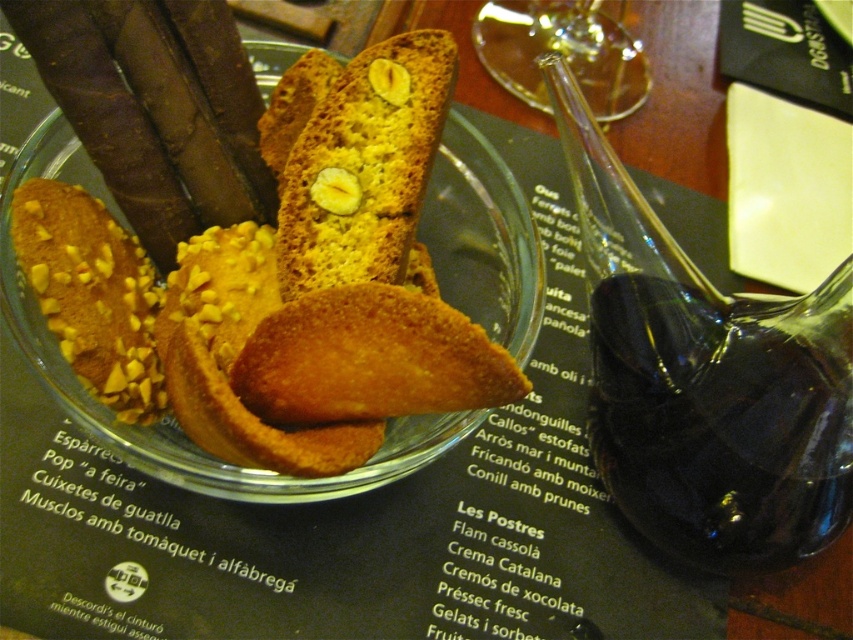
In the scene shown: You are a customer at a dessert bar and see both the golden crumbly biscuit at center and the golden crumbly biscotti at center. Which one is placed directly below the other?

The golden crumbly biscuit at center is positioned under the golden crumbly biscotti at center, so the biscuit is directly below the biscotti.

You are a customer at the dessert counter and want to know which item is taller between the golden crumbly biscotti at center and the transparent glass at upper center. Can you tell me based on their positions?

The golden crumbly biscotti at center is much taller than the transparent glass at upper center according to their positions.

You are a customer at a cafe and want to choose between the golden crumbly biscotti at center and the transparent glass at upper center. Based on their sizes, which one is smaller?

The golden crumbly biscotti at center has a lesser width compared to the transparent glass at upper center, so the golden crumbly biscotti at center is smaller.